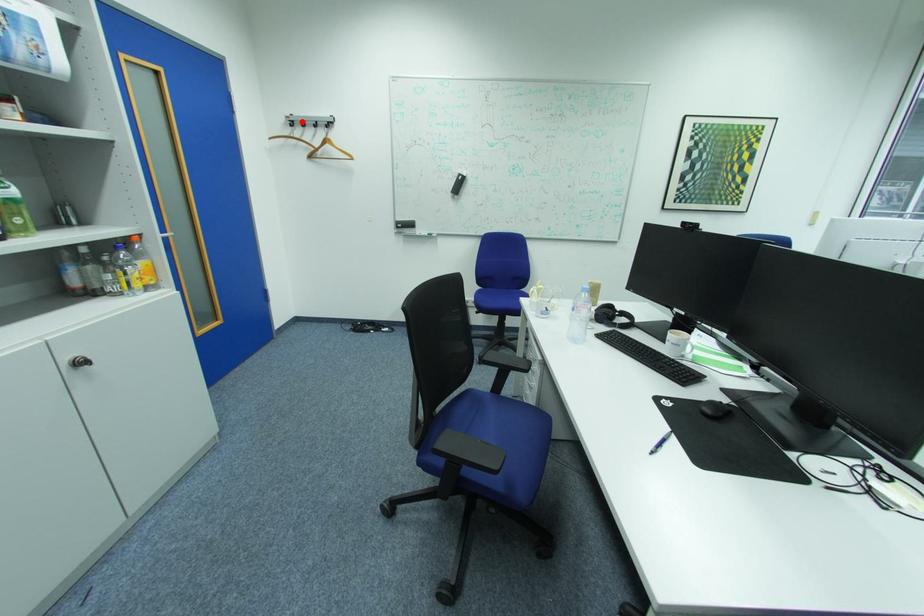
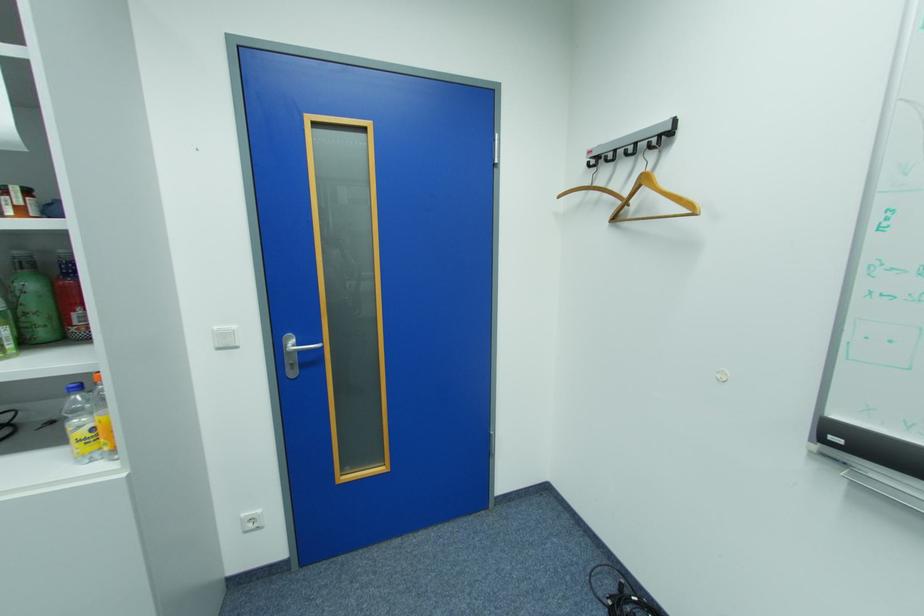
The point at the highlighted location is marked in the first image. Where is the corresponding point in the second image?

(606, 159)